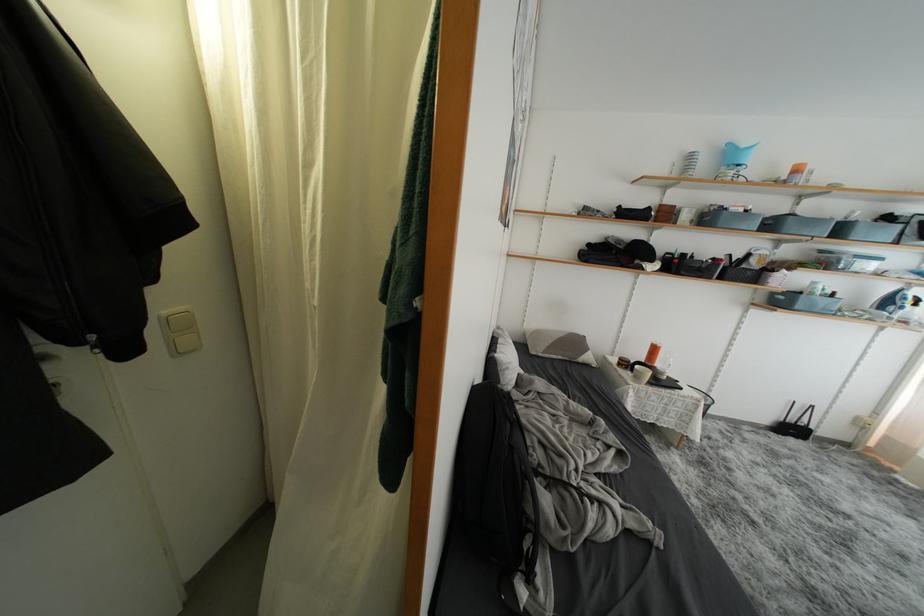
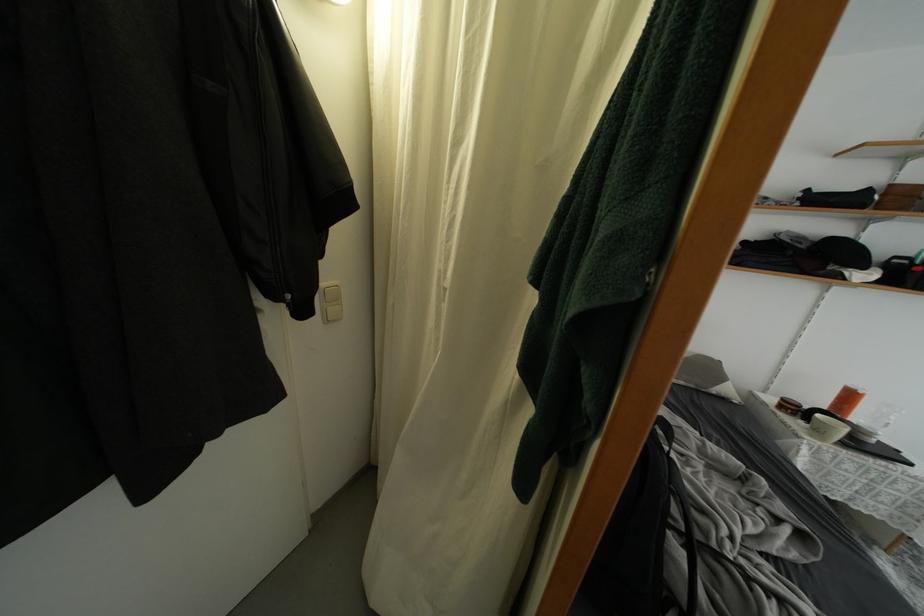
Find the pixel in the second image that matches (x=661, y=354) in the first image.

(856, 400)